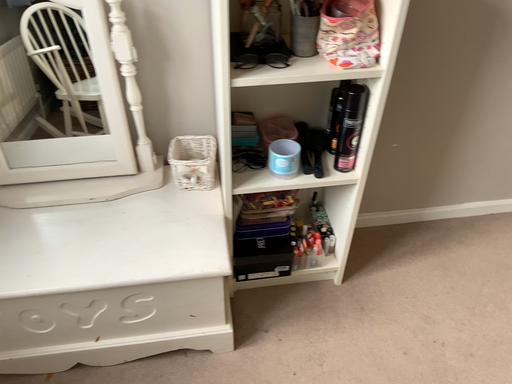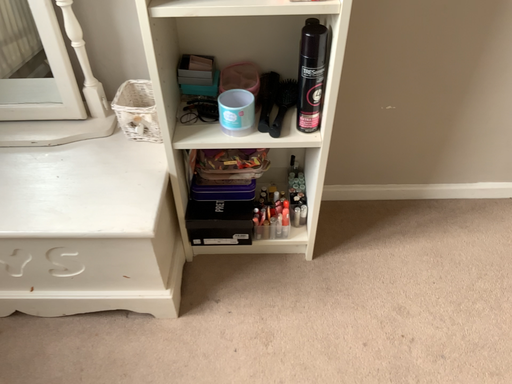
Question: Which way did the camera rotate in the video?

Choices:
 (A) rotated left
 (B) rotated right

Answer: (A)